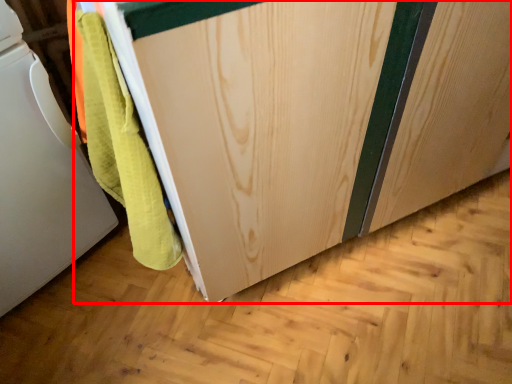
Question: From the image's perspective, where is cabinetry (annotated by the red box) located in relation to home appliance in the image?

Choices:
 (A) below
 (B) above

Answer: (B)